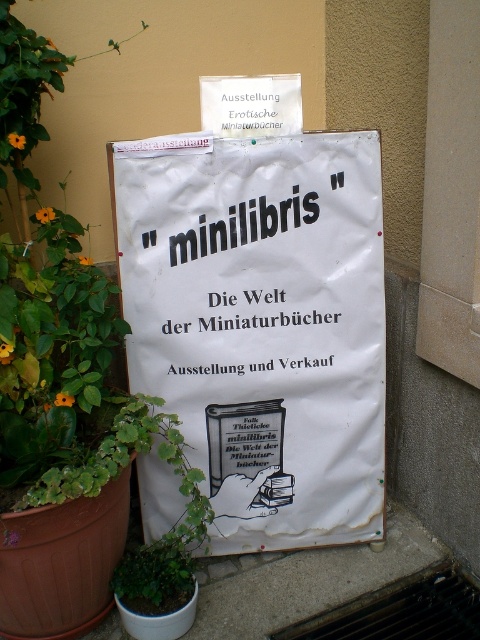
Between point (197, 280) and point (128, 552), which one is positioned behind?

The point (128, 552) is more distant.

Where is `white paper sign at center`? This screenshot has width=480, height=640. white paper sign at center is located at coordinates (262, 324).